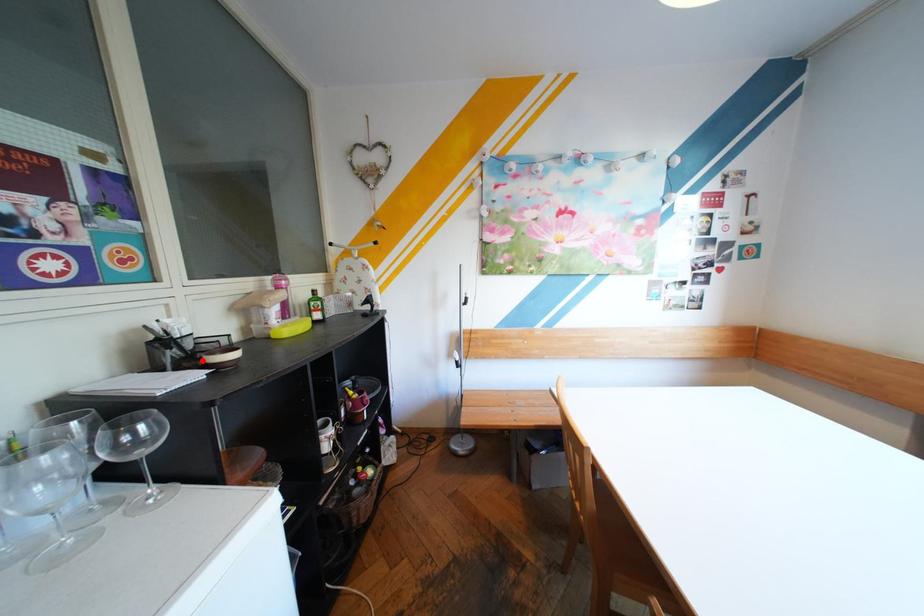
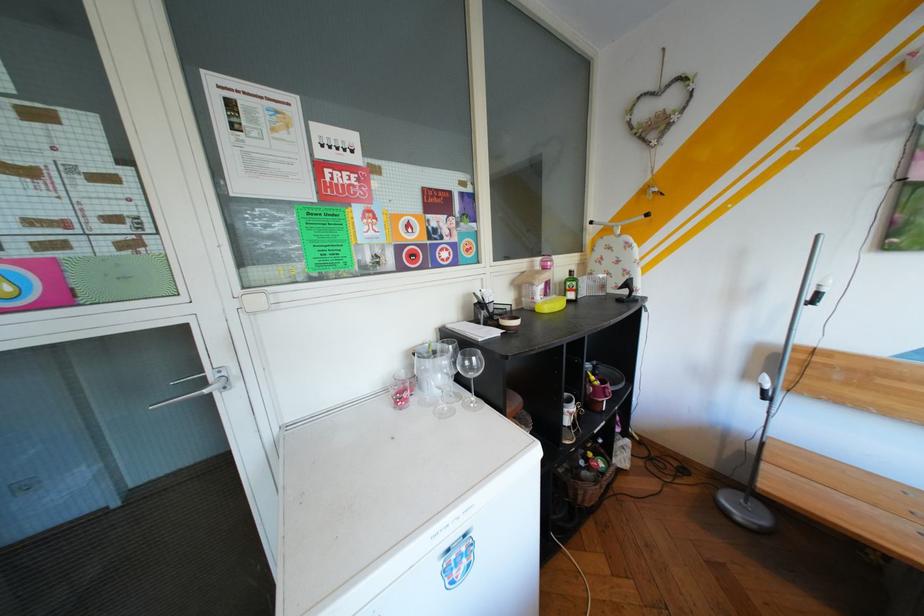
In the second image, find the point that corresponds to the highlighted location in the first image.

(505, 320)